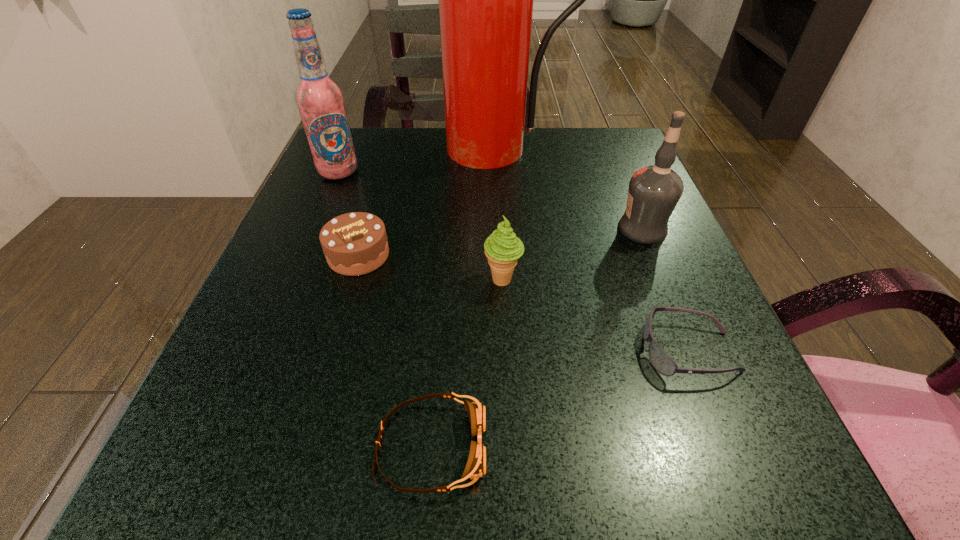
I want to click on free space located on the front label of the third tallest object, so click(575, 229).

The width and height of the screenshot is (960, 540). Find the location of `free space located 0.190m on the front label of the third tallest object`. free space located 0.190m on the front label of the third tallest object is located at coordinates (516, 229).

Image resolution: width=960 pixels, height=540 pixels. I want to click on free spot located 0.220m on the left of the fourth tallest object, so click(350, 279).

The width and height of the screenshot is (960, 540). What are the coordinates of `vacant space located on the right of the fifth tallest object` in the screenshot? It's located at [419, 255].

Locate an element on the screen. The image size is (960, 540). blank space located 0.380m on the lenses of the sunglasses is located at coordinates (376, 350).

Where is `free space located on the lenses of the sunglasses`? This screenshot has width=960, height=540. free space located on the lenses of the sunglasses is located at coordinates (446, 350).

You are a GUI agent. You are given a task and a screenshot of the screen. Output one action in this format:
    pyautogui.click(x=<x>, y=<y>)
    Task: Click on the vacant area situated on the lenses of the sunglasses
    Image resolution: width=960 pixels, height=540 pixels.
    Given the screenshot: What is the action you would take?
    pyautogui.click(x=552, y=350)

Image resolution: width=960 pixels, height=540 pixels. I want to click on vacant space located 0.160m with the lenses facing forward on the goggles, so click(619, 446).

Identify the location of fire extinguisher present at the far edge. This screenshot has width=960, height=540. (485, 0).

Where is `alcohol that is at the far edge`? This screenshot has width=960, height=540. alcohol that is at the far edge is located at coordinates (320, 101).